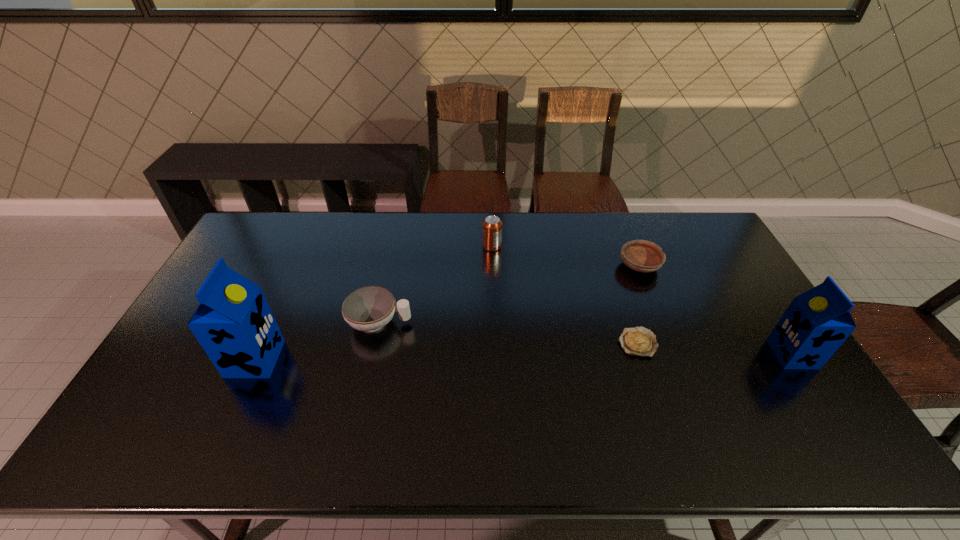
Find the location of a particular element. The height and width of the screenshot is (540, 960). free space between the shortest object and the second tallest object is located at coordinates click(x=715, y=348).

This screenshot has width=960, height=540. Identify the location of unoccupied position between the fifth shortest object and the shortest object. (715, 348).

The image size is (960, 540). I want to click on unoccupied position between the second tallest object and the chinaware, so click(586, 339).

This screenshot has height=540, width=960. I want to click on vacant space in between the second shortest object and the third object from left to right, so click(565, 256).

At what (x,y) coordinates should I click in order to perform the action: click on vacant area that lies between the second farthest object and the chinaware. Please return your answer as a coordinate pair (x, y). This screenshot has width=960, height=540. Looking at the image, I should click on (510, 294).

The width and height of the screenshot is (960, 540). What are the coordinates of `vacant space that is in between the quiche and the farthest object` in the screenshot? It's located at (564, 294).

In order to click on empty location between the left carton and the right carton in this screenshot , I will do `click(524, 356)`.

Locate an element on the screen. the third closest object to the second object from left to right is located at coordinates (639, 341).

I want to click on the closest object to the fifth tallest object, so click(x=639, y=341).

I want to click on blank area in the image that satisfies the following two spatial constraints: 1. on the front side of the shortest object; 2. on the left side of the farthest object, so click(495, 342).